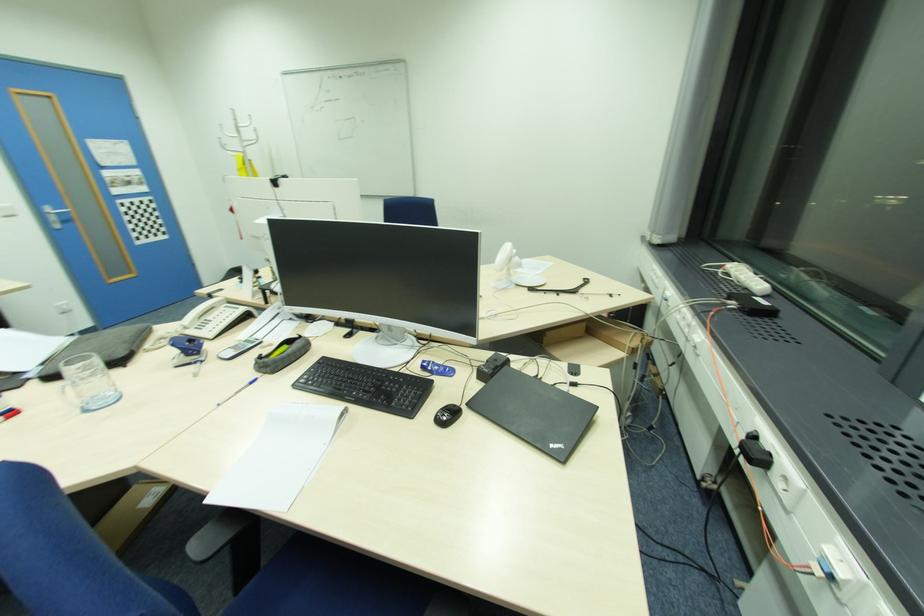
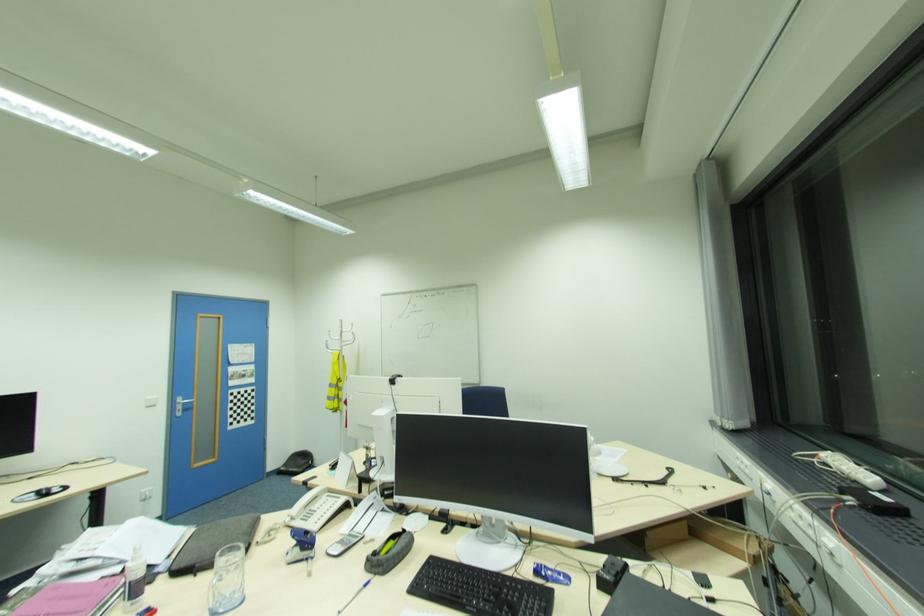
Find the pixel in the second image that matches pixel 44 375 in the first image.

(177, 568)